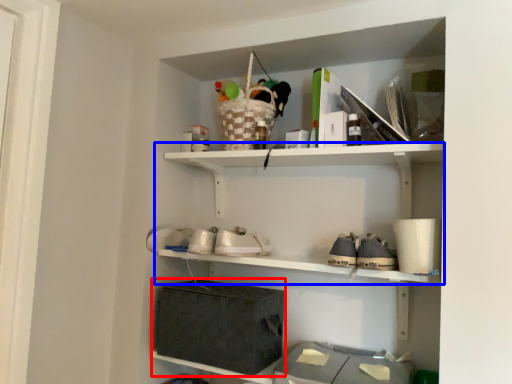
Question: Which object is closer to the camera taking this photo, storage box (highlighted by a red box) or shelf (highlighted by a blue box)?

Choices:
 (A) storage box
 (B) shelf

Answer: (B)